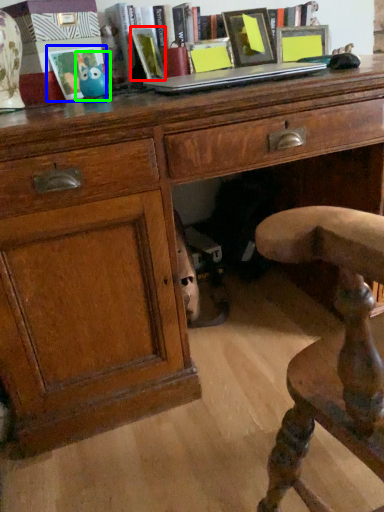
Question: Based on their relative distances, which object is nearer to book (highlighted by a red box)? Choose from picture frame (highlighted by a blue box) and toy (highlighted by a green box).

Choices:
 (A) picture frame
 (B) toy

Answer: (B)